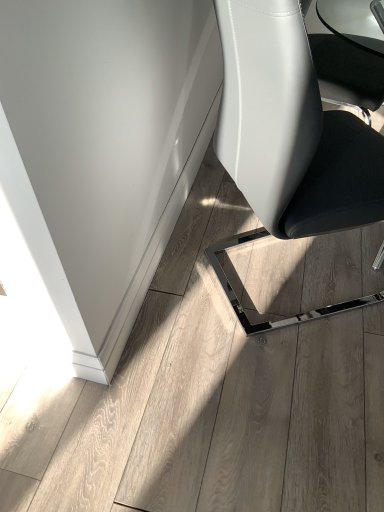
At what (x,y) coordinates should I click in order to perform the action: click on free space to the left of white leather chair at center. Please return your answer as a coordinate pair (x, y). Looking at the image, I should click on (177, 298).